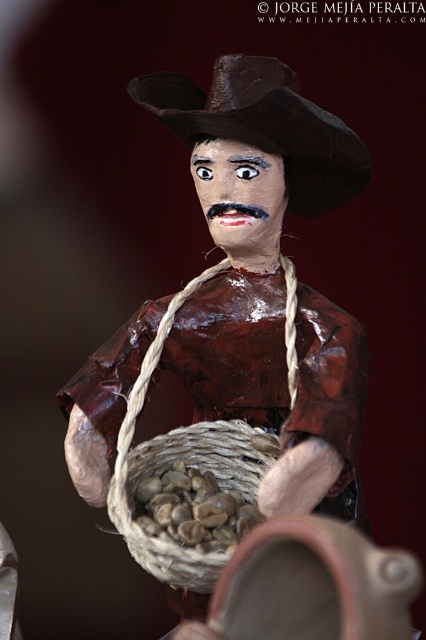
Question: Is brown paper cowboy hat at center wider than woven brown basket at center?

Choices:
 (A) yes
 (B) no

Answer: (A)

Question: Which is nearer to the matte brown figure at center?

Choices:
 (A) brown paper cowboy hat at center
 (B) woven brown basket at center
 (C) brown matte nuts at center

Answer: (A)

Question: Based on their relative distances, which object is farther from the woven brown basket at center?

Choices:
 (A) brown matte nuts at center
 (B) brown paper cowboy hat at center

Answer: (B)

Question: Which point is farther from the camera taking this photo?

Choices:
 (A) (155, 308)
 (B) (239, 422)
 (C) (166, 477)

Answer: (A)

Question: Does woven brown basket at center have a larger size compared to brown matte nuts at center?

Choices:
 (A) no
 (B) yes

Answer: (B)

Question: Does matte brown figure at center appear on the right side of brown matte nuts at center?

Choices:
 (A) yes
 (B) no

Answer: (A)